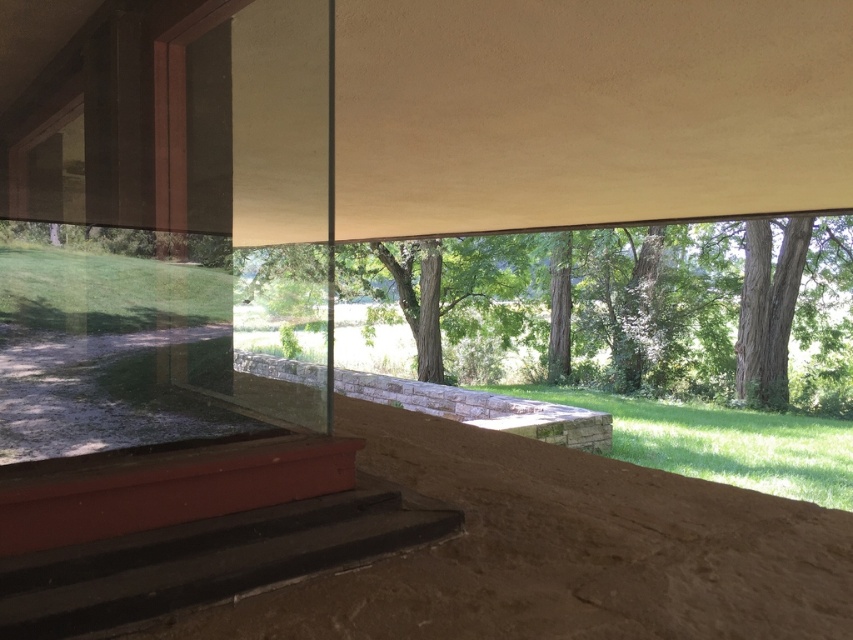
Question: Observing the image, what is the correct spatial positioning of green leafy tree at center in reference to smooth black stairs at lower left?

Choices:
 (A) right
 (B) left

Answer: (A)

Question: Which object appears closest to the camera in this image?

Choices:
 (A) green leafy tree at center
 (B) smooth black stairs at lower left

Answer: (B)

Question: Which object is closer to the camera taking this photo?

Choices:
 (A) smooth black stairs at lower left
 (B) green leafy tree at center

Answer: (A)

Question: Is green leafy tree at center bigger than smooth black stairs at lower left?

Choices:
 (A) yes
 (B) no

Answer: (A)

Question: Does green leafy tree at center have a lesser width compared to smooth black stairs at lower left?

Choices:
 (A) yes
 (B) no

Answer: (B)